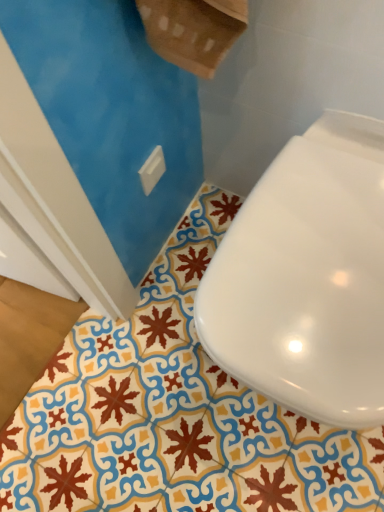
The width and height of the screenshot is (384, 512). What do you see at coordinates (307, 277) in the screenshot?
I see `white glossy toilet at lower right` at bounding box center [307, 277].

You are a GUI agent. You are given a task and a screenshot of the screen. Output one action in this format:
    pyautogui.click(x=<x>, y=<y>)
    Task: Click on the white glossy toilet at lower right
    This screenshot has height=512, width=384.
    Given the screenshot: What is the action you would take?
    pyautogui.click(x=307, y=277)

This screenshot has height=512, width=384. Identify the location of white glossy toilet at lower right. (307, 277).